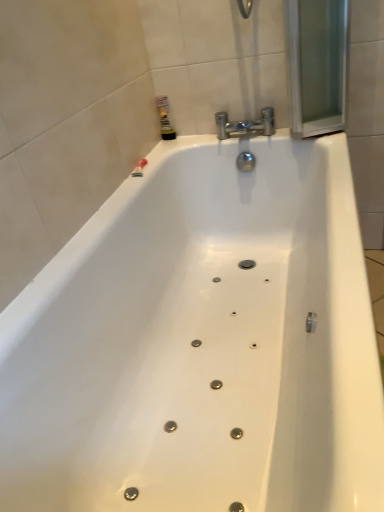
Describe the element at coordinates (245, 125) in the screenshot. The image size is (384, 512). I see `chrome metallic faucet at upper center` at that location.

In order to face chrome metallic faucet at upper center, should I rotate leftwards or rightwards?

Rotate your view right by about 6.615°.

Measure the distance between chrome metallic faucet at upper center and camera.

The distance of chrome metallic faucet at upper center from camera is 5.55 feet.

This screenshot has width=384, height=512. In order to click on chrome metallic faucet at upper center in this screenshot , I will do `click(245, 125)`.

This screenshot has height=512, width=384. Identify the location of chrome metallic faucet at upper center. (245, 125).